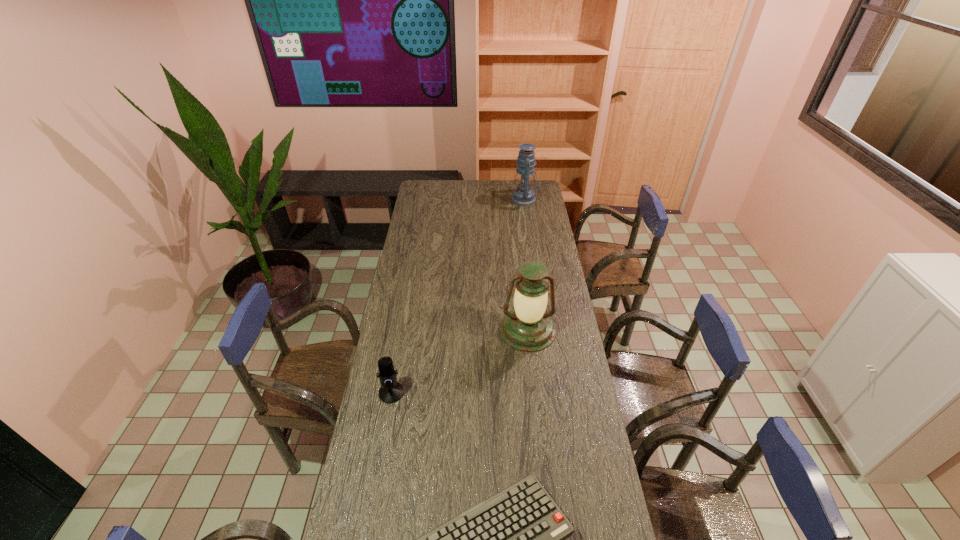
Where is `free point between the leftmost object and the second farthest object`? The image size is (960, 540). free point between the leftmost object and the second farthest object is located at coordinates click(x=460, y=361).

Choose which object is the third nearest neighbor to the shortest object. Please provide its 2D coordinates. Your answer should be formatted as a tuple, i.e. [(x, y)], where the tuple contains the x and y coordinates of a point satisfying the conditions above.

[(523, 195)]

This screenshot has height=540, width=960. I want to click on object that ranks as the second closest to the nearer lantern, so click(x=516, y=539).

At what (x,y) coordinates should I click in order to perform the action: click on free space that satisfies the following two spatial constraints: 1. on the front-facing side of the farthest object; 2. with the light compartment facing forward on the nearer lantern. Please return your answer as a coordinate pair (x, y). This screenshot has width=960, height=540. Looking at the image, I should click on (544, 330).